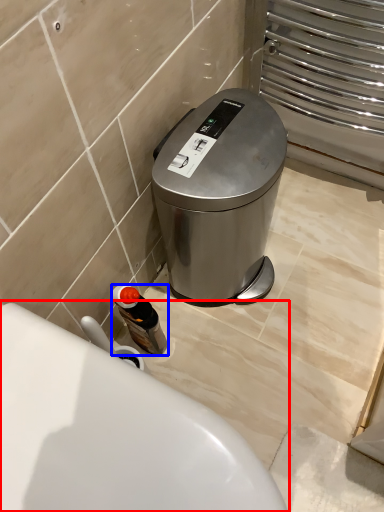
Question: Which object is closer to the camera taking this photo, toilet (highlighted by a red box) or bottle (highlighted by a blue box)?

Choices:
 (A) toilet
 (B) bottle

Answer: (A)